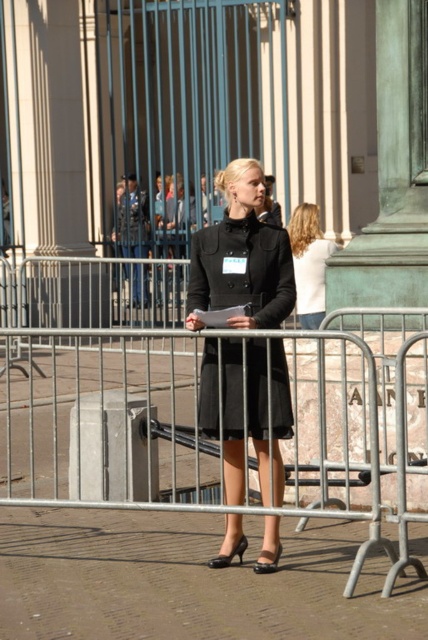
Is the position of metallic silver fence at center more distant than that of black woolen coat at center?

No, metallic silver fence at center is in front of black woolen coat at center.

Locate an element on the screen. metallic silver fence at center is located at coordinates (223, 422).

Does point (83, 340) come closer to viewer compared to point (303, 276)?

No, (83, 340) is behind (303, 276).

Is point (183, 429) positioned in front of point (314, 314)?

Yes, it is in front of point (314, 314).

I want to click on metallic silver fence at center, so click(x=223, y=422).

Which is in front, point (222, 356) or point (309, 321)?

Point (222, 356) is more forward.

Locate an element on the screen. black woolen coat at center is located at coordinates (243, 269).